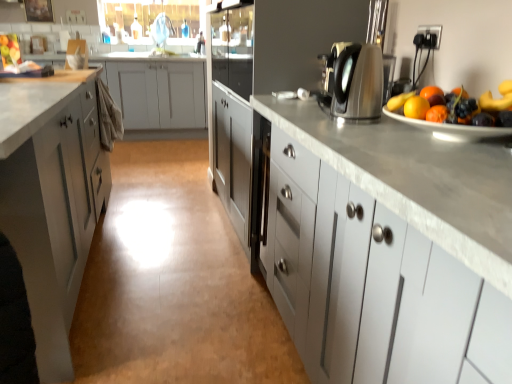
Question: Is white glossy sink at upper center taller than shiny ceramic plate at right?

Choices:
 (A) no
 (B) yes

Answer: (B)

Question: Considering the relative sizes of white glossy sink at upper center and shiny ceramic plate at right in the image provided, is white glossy sink at upper center wider than shiny ceramic plate at right?

Choices:
 (A) no
 (B) yes

Answer: (A)

Question: Considering the relative positions of white glossy sink at upper center and shiny ceramic plate at right in the image provided, is white glossy sink at upper center to the left of shiny ceramic plate at right from the viewer's perspective?

Choices:
 (A) yes
 (B) no

Answer: (A)

Question: Is white glossy sink at upper center further to the viewer compared to shiny ceramic plate at right?

Choices:
 (A) no
 (B) yes

Answer: (B)

Question: Is white glossy sink at upper center smaller than shiny ceramic plate at right?

Choices:
 (A) yes
 (B) no

Answer: (B)

Question: Would you say white glossy sink at upper center is a long distance from shiny ceramic plate at right?

Choices:
 (A) no
 (B) yes

Answer: (B)

Question: From the image's perspective, is white matte cabinet at left, the first cabinetry from the back, on top of white matte cabinet at left, arranged as the second cabinetry when viewed from the front?

Choices:
 (A) yes
 (B) no

Answer: (A)

Question: Does white matte cabinet at left, marked as the first cabinetry in a left-to-right arrangement, appear on the left side of white matte cabinet at left, arranged as the second cabinetry when viewed from the front?

Choices:
 (A) no
 (B) yes

Answer: (B)

Question: Is white matte cabinet at left, the 3th cabinetry positioned from the front, aimed at white matte cabinet at left, the second cabinetry when ordered from back to front?

Choices:
 (A) yes
 (B) no

Answer: (A)

Question: Would you say white matte cabinet at left, which is the third cabinetry in right-to-left order, contains white matte cabinet at left, positioned as the 2th cabinetry in right-to-left order?

Choices:
 (A) yes
 (B) no

Answer: (B)

Question: Is white matte cabinet at left, which is the third cabinetry in right-to-left order, positioned with its back to white matte cabinet at left, positioned as the 2th cabinetry in right-to-left order?

Choices:
 (A) no
 (B) yes

Answer: (A)

Question: Are white matte cabinet at left, the first cabinetry from the back, and white matte cabinet at left, positioned as the 2th cabinetry in right-to-left order, beside each other?

Choices:
 (A) no
 (B) yes

Answer: (A)

Question: Considering the relative sizes of white matte cabinet at left, arranged as the second cabinetry when viewed from the front, and white matte cabinet at left, which is the third cabinetry in right-to-left order, in the image provided, is white matte cabinet at left, arranged as the second cabinetry when viewed from the front, taller than white matte cabinet at left, which is the third cabinetry in right-to-left order,?

Choices:
 (A) no
 (B) yes

Answer: (B)